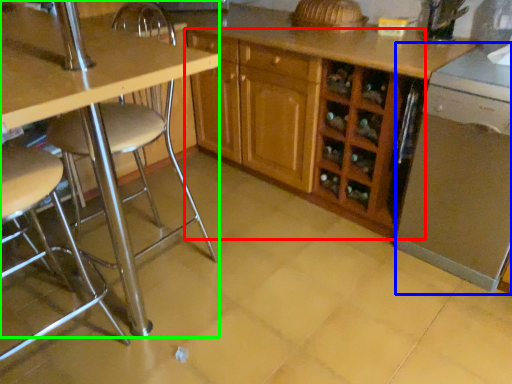
Question: Based on their relative distances, which object is nearer to cabinetry (highlighted by a red box)? Choose from dish washer (highlighted by a blue box) and table (highlighted by a green box).

Choices:
 (A) dish washer
 (B) table

Answer: (A)